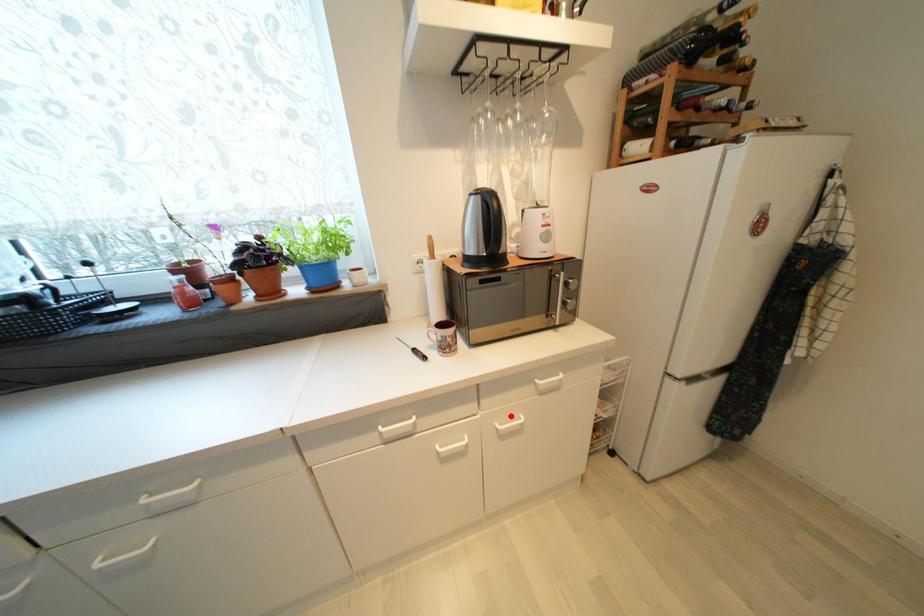
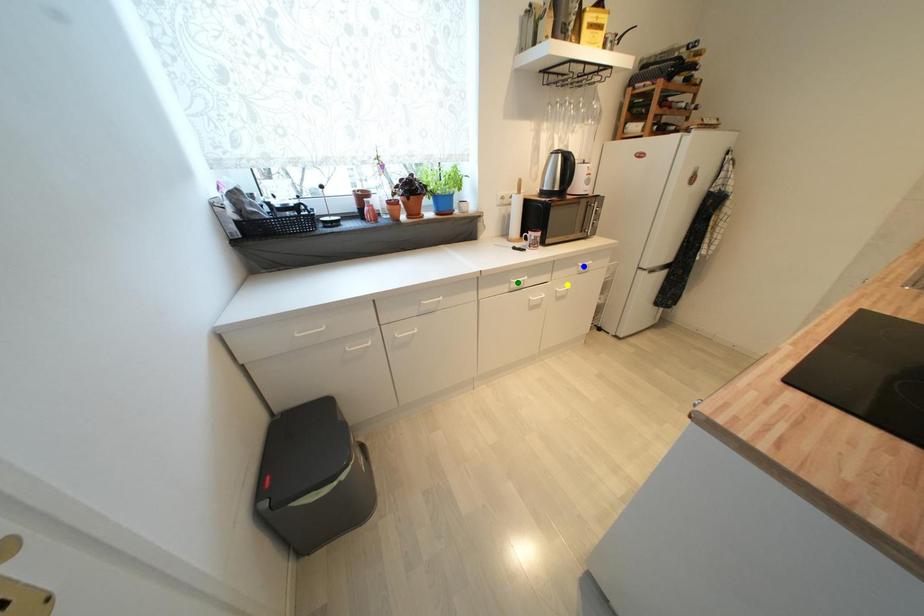
Question: I am providing you with two images of the same scene from different viewpoints. A red point is marked on the first image. You are given multiple points on the second image. Can you choose the point in image 2 that corresponds to the point in image 1?

Choices:
 (A) yellow point
 (B) green point
 (C) blue point

Answer: (A)